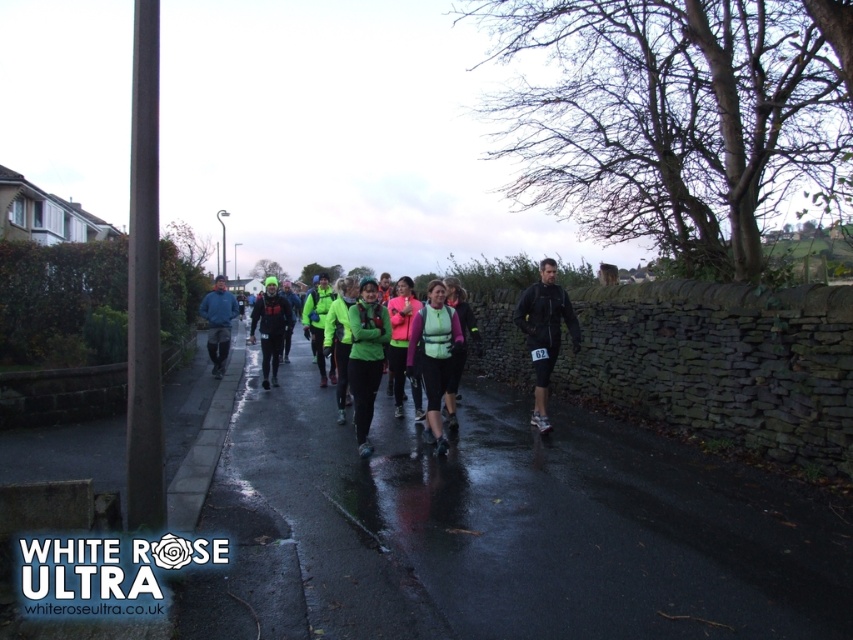
Question: In this image, where is green matte vest at center located relative to green matte jacket at center?

Choices:
 (A) left
 (B) right

Answer: (B)

Question: Can you confirm if green fabric jacket at center is positioned to the right of black matte running suit at center?

Choices:
 (A) yes
 (B) no

Answer: (A)

Question: Which point is closer to the camera?

Choices:
 (A) matte black jacket at center
 (B) green matte vest at center

Answer: (B)

Question: Among these objects, which one is farthest from the camera?

Choices:
 (A) matte blue jacket at center
 (B) green fabric jacket at center

Answer: (A)

Question: Which of the following is the farthest from the observer?

Choices:
 (A) (407, 276)
 (B) (265, 321)

Answer: (B)

Question: Is matte black jacket at center closer to the viewer compared to green matte vest at center?

Choices:
 (A) yes
 (B) no

Answer: (B)